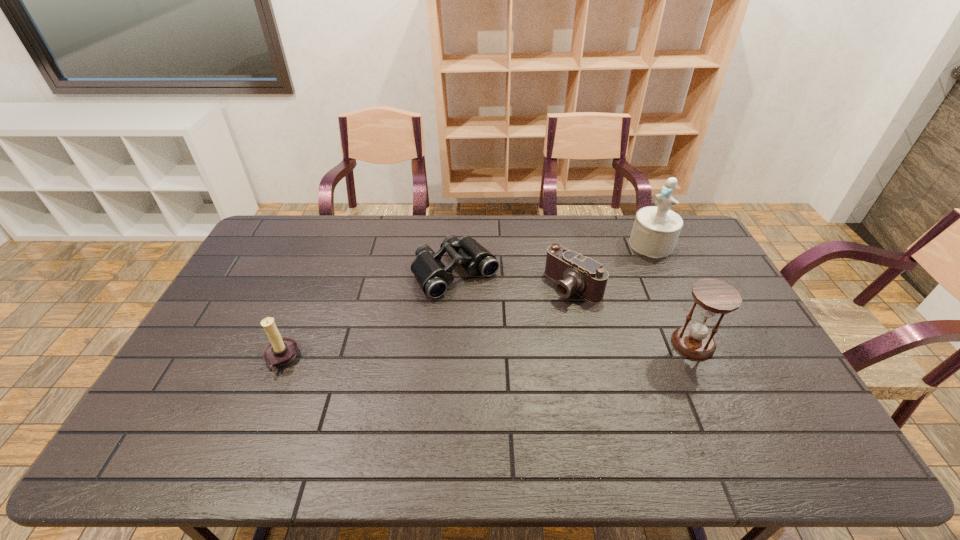
Find the location of a particular element. This screenshot has width=960, height=540. object that is the third nearest to the second object from left to right is located at coordinates (656, 229).

I want to click on the fourth closest object to the second object from left to right, so click(x=714, y=297).